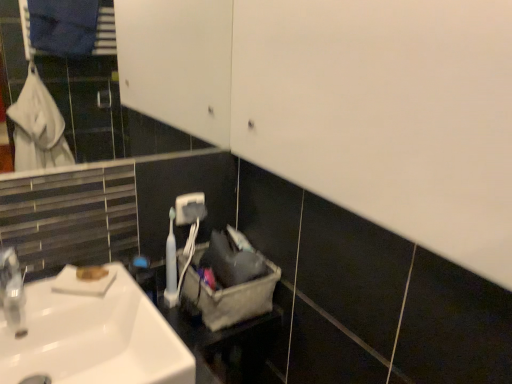
Question: Should I look upward or downward to see white plastic toothbrush at center?

Choices:
 (A) up
 (B) down

Answer: (B)

Question: Can you confirm if gray fabric laundry basket at center is taller than white matte soap at lower left?

Choices:
 (A) no
 (B) yes

Answer: (B)

Question: Considering the relative positions of gray fabric laundry basket at center and white matte soap at lower left in the image provided, is gray fabric laundry basket at center to the right of white matte soap at lower left from the viewer's perspective?

Choices:
 (A) yes
 (B) no

Answer: (A)

Question: From the image's perspective, is gray fabric laundry basket at center under white matte soap at lower left?

Choices:
 (A) no
 (B) yes

Answer: (B)

Question: Is gray fabric laundry basket at center to the left of white matte soap at lower left from the viewer's perspective?

Choices:
 (A) yes
 (B) no

Answer: (B)

Question: Can white matte soap at lower left be found inside gray fabric laundry basket at center?

Choices:
 (A) yes
 (B) no

Answer: (B)

Question: Does gray fabric laundry basket at center lie in front of white matte soap at lower left?

Choices:
 (A) no
 (B) yes

Answer: (A)

Question: Is the position of white glossy sink at lower left less distant than that of white matte soap at lower left?

Choices:
 (A) no
 (B) yes

Answer: (B)

Question: From the image's perspective, is white glossy sink at lower left beneath white matte soap at lower left?

Choices:
 (A) no
 (B) yes

Answer: (B)

Question: From a real-world perspective, does white glossy sink at lower left stand above white matte soap at lower left?

Choices:
 (A) yes
 (B) no

Answer: (B)

Question: Is white glossy sink at lower left to the right of white matte soap at lower left from the viewer's perspective?

Choices:
 (A) no
 (B) yes

Answer: (B)

Question: Does white glossy sink at lower left have a greater width compared to white matte soap at lower left?

Choices:
 (A) yes
 (B) no

Answer: (A)

Question: Is white glossy sink at lower left taller than white matte soap at lower left?

Choices:
 (A) yes
 (B) no

Answer: (A)

Question: Can you confirm if gray fabric laundry basket at center is smaller than white glossy sink at lower left?

Choices:
 (A) yes
 (B) no

Answer: (A)